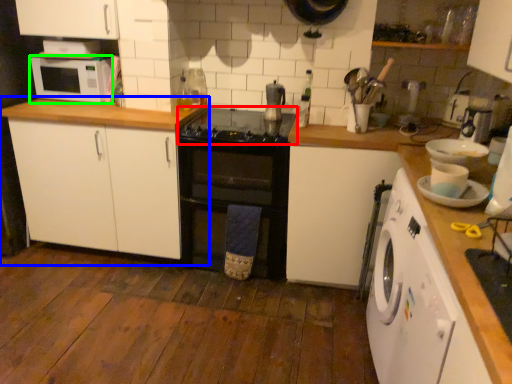
Question: Which object is the farthest from gas stove (highlighted by a red box)? Choose among these: cabinetry (highlighted by a blue box) or microwave oven (highlighted by a green box).

Choices:
 (A) cabinetry
 (B) microwave oven

Answer: (B)